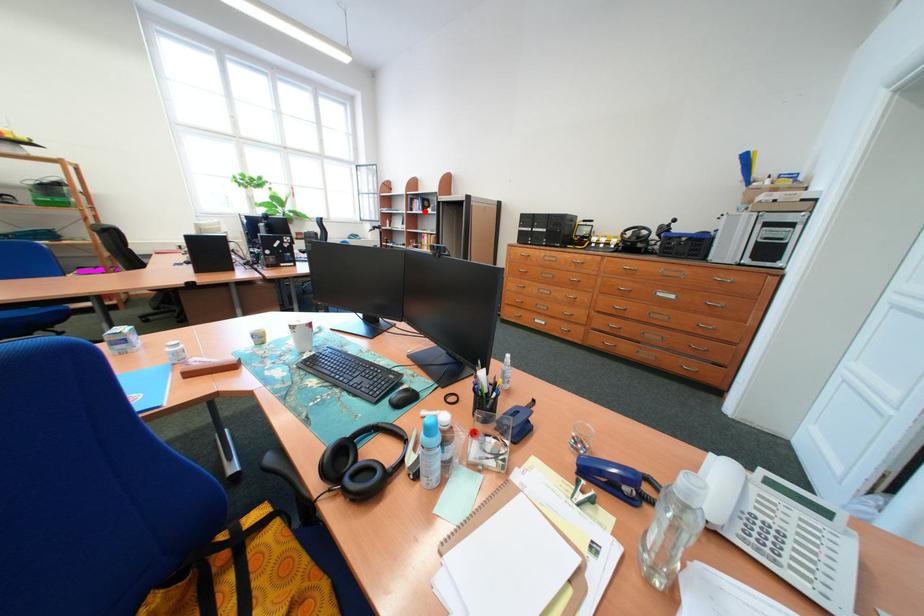
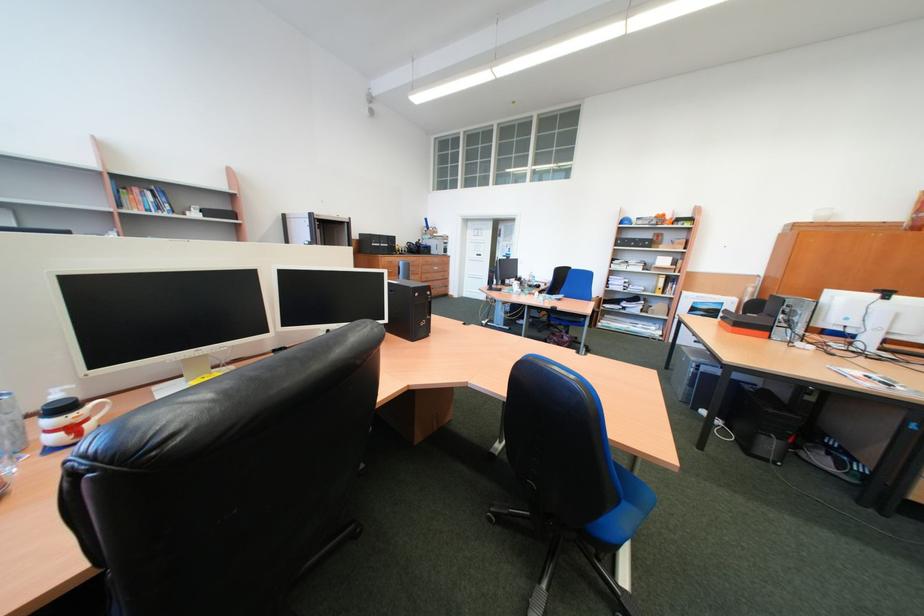
The point at the highlighted location is marked in the first image. Where is the corresponding point in the second image?

(134, 207)